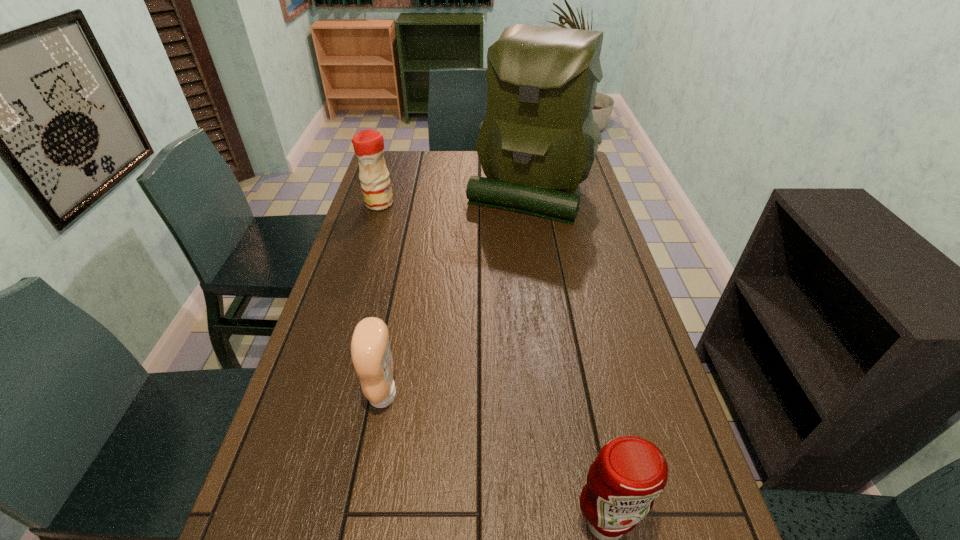
Select which object is the second closest to the backpack. Please provide its 2D coordinates. Your answer should be formatted as a tuple, i.e. [(x, y)], where the tuple contains the x and y coordinates of a point satisfying the conditions above.

[(370, 349)]

Choose which object is the third nearest neighbor to the backpack. Please provide its 2D coordinates. Your answer should be formatted as a tuple, i.e. [(x, y)], where the tuple contains the x and y coordinates of a point satisfying the conditions above.

[(629, 472)]

Where is `condiment that can be found as the second closest to the third farthest object`? condiment that can be found as the second closest to the third farthest object is located at coordinates (368, 145).

Locate which condiment is the second closest to the backpack. Please provide its 2D coordinates. Your answer should be formatted as a tuple, i.e. [(x, y)], where the tuple contains the x and y coordinates of a point satisfying the conditions above.

[(370, 349)]

Locate an element on the screen. This screenshot has height=540, width=960. vacant point that satisfies the following two spatial constraints: 1. on the front of the backpack with visible pockets; 2. on the label of the second condiment from right to left is located at coordinates (561, 395).

You are a GUI agent. You are given a task and a screenshot of the screen. Output one action in this format:
    pyautogui.click(x=<x>, y=<y>)
    Task: Click on the vacant space that satisfies the following two spatial constraints: 1. on the front of the backpack with visible pockets; 2. on the label of the second farthest condiment
    The height and width of the screenshot is (540, 960).
    Given the screenshot: What is the action you would take?
    pyautogui.click(x=561, y=395)